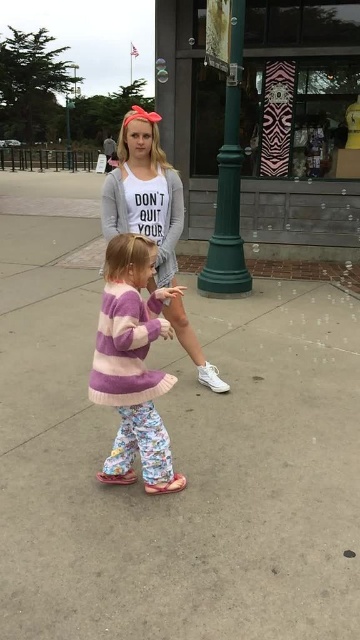
Question: Which object is positioned farthest from the gray concrete pavement at center?

Choices:
 (A) green metal pole at upper center
 (B) matte gray sweatshirt at center
 (C) purple knit sweater at center
 (D) green matte pole at center

Answer: (A)

Question: Can you confirm if gray concrete pavement at center is wider than matte gray sweatshirt at center?

Choices:
 (A) yes
 (B) no

Answer: (A)

Question: Based on their relative distances, which object is nearer to the green matte pole at center?

Choices:
 (A) purple knit sweater at center
 (B) green metal pole at upper center
 (C) gray concrete pavement at center

Answer: (C)

Question: Does purple knit sweater at center have a larger size compared to green matte pole at center?

Choices:
 (A) yes
 (B) no

Answer: (B)

Question: Observing the image, what is the correct spatial positioning of gray concrete pavement at center in reference to purple knit sweater at center?

Choices:
 (A) above
 (B) below

Answer: (A)

Question: Which object is farther from the camera taking this photo?

Choices:
 (A) green metal pole at upper center
 (B) purple knit sweater at center
 (C) green matte pole at center

Answer: (A)